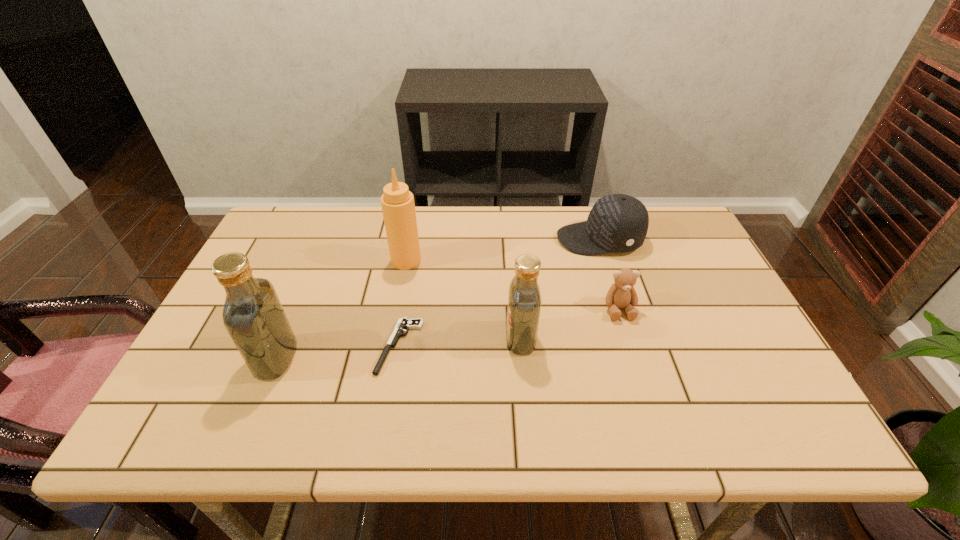
Where is `the left vodka`? the left vodka is located at coordinates (253, 316).

The image size is (960, 540). What are the coordinates of `the leftmost object` in the screenshot? It's located at (253, 316).

The height and width of the screenshot is (540, 960). Identify the location of the fourth shortest object. (524, 297).

Locate an element on the screen. the shorter vodka is located at coordinates (524, 297).

What are the coordinates of `condiment` in the screenshot? It's located at (398, 207).

This screenshot has width=960, height=540. Find the location of `baseball cap`. baseball cap is located at coordinates (617, 222).

You are a GUI agent. You are given a task and a screenshot of the screen. Output one action in this format:
    pyautogui.click(x=<x>, y=<y>)
    Task: Click on the shortest object
    
    Given the screenshot: What is the action you would take?
    pos(403,323)

Locate an element on the screen. Image resolution: width=960 pixels, height=540 pixels. the second shortest object is located at coordinates (621, 294).

Where is `vacant space positioned on the front-facing side of the fourth shortest object`? The height and width of the screenshot is (540, 960). vacant space positioned on the front-facing side of the fourth shortest object is located at coordinates (372, 339).

At what (x,y) coordinates should I click in order to perform the action: click on vacant space located on the front-facing side of the fourth shortest object. Please return your answer as a coordinate pair (x, y). The width and height of the screenshot is (960, 540). Looking at the image, I should click on (453, 339).